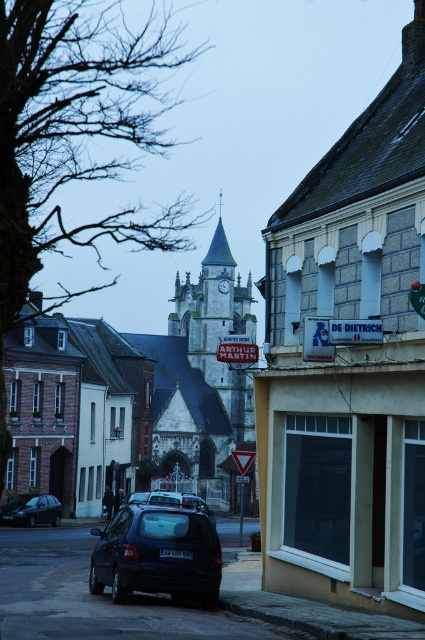
Question: Is white stone church at center positioned in front of dark gray metallic car at lower left?

Choices:
 (A) yes
 (B) no

Answer: (A)

Question: Does white stone church at center come behind dark gray metallic car at lower left?

Choices:
 (A) yes
 (B) no

Answer: (B)

Question: Which point is closer to the camera?

Choices:
 (A) stone clock tower at center
 (B) dark blue matte hatchback at center

Answer: (B)

Question: Which of these objects is positioned closest to the metallic gray clock at center?

Choices:
 (A) dark blue matte hatchback at center
 (B) stone clock tower at center

Answer: (B)

Question: From the image, what is the correct spatial relationship of dark gray metallic car at lower left in relation to metallic gray clock at center?

Choices:
 (A) right
 (B) left

Answer: (B)

Question: Which point appears farthest from the camera in this image?

Choices:
 (A) (33, 520)
 (B) (175, 531)
 (C) (232, 444)

Answer: (C)